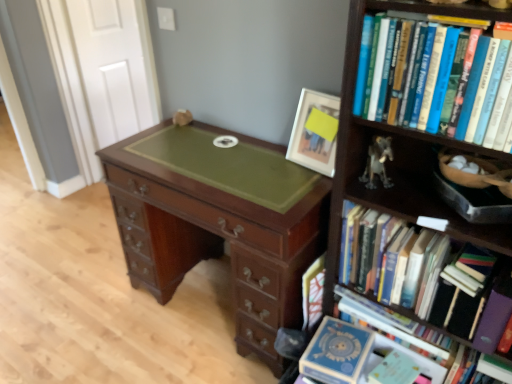
This screenshot has height=384, width=512. Find the location of `vacant space situated on the left part of matte white picture frame at upper right`. vacant space situated on the left part of matte white picture frame at upper right is located at coordinates (274, 164).